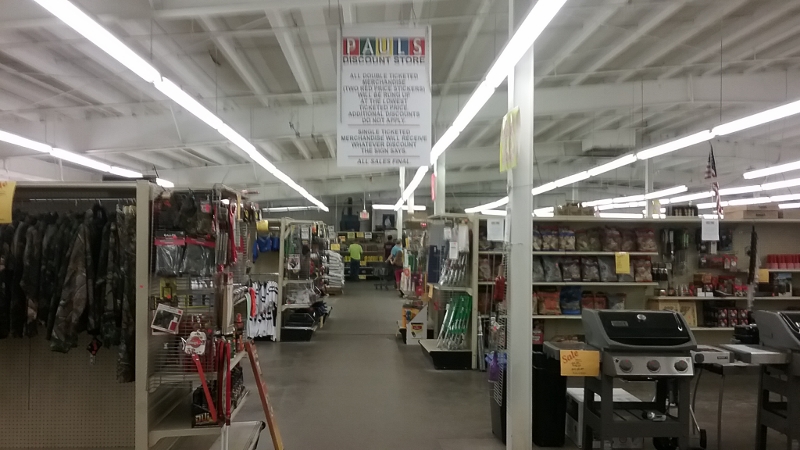
This screenshot has width=800, height=450. In order to click on pegboard in this screenshot , I will do `click(85, 403)`.